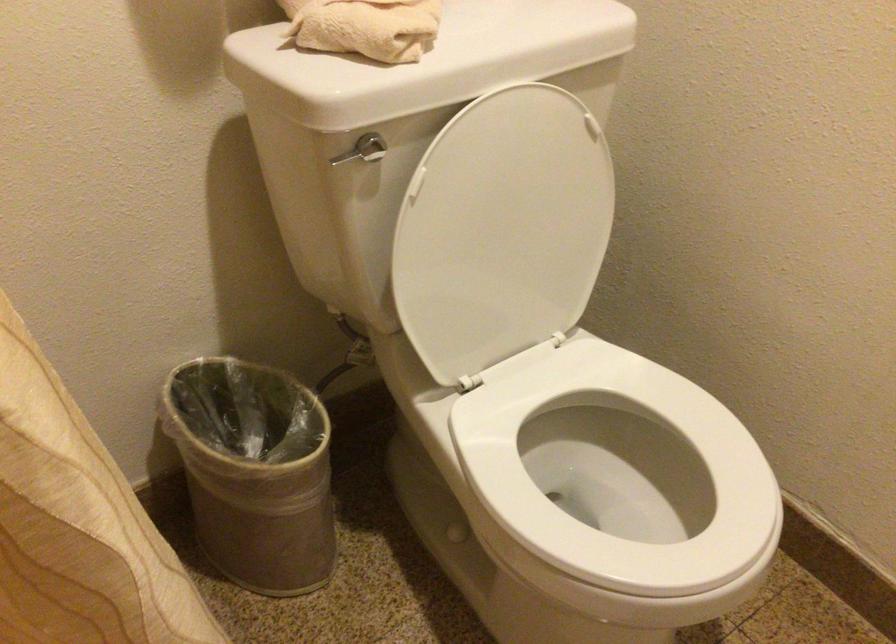
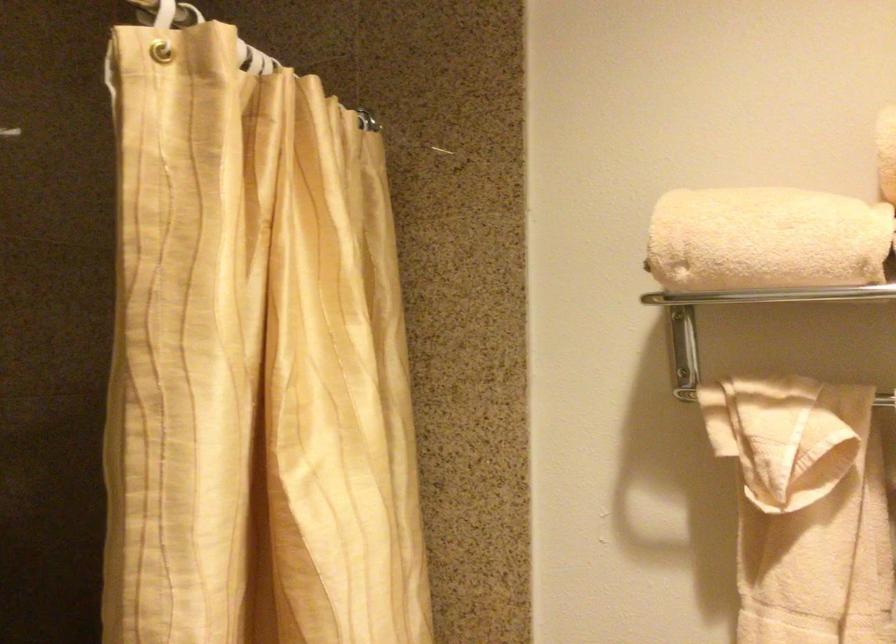
How did the camera likely rotate?

The rotation direction of the camera is left-up.